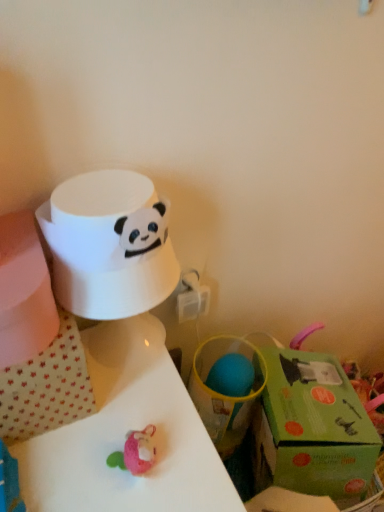
Question: In the image, is green cardboard gift box at lower right positioned in front of or behind white glossy table at center?

Choices:
 (A) front
 (B) behind

Answer: (B)

Question: Do you think green cardboard gift box at lower right is within white glossy table at center, or outside of it?

Choices:
 (A) outside
 (B) inside

Answer: (A)

Question: Based on their relative distances, which object is nearer to the white glossy table at center?

Choices:
 (A) white matte paper towel at upper left
 (B) green cardboard gift box at lower right

Answer: (A)

Question: Considering the real-world distances, which object is closest to the green cardboard gift box at lower right?

Choices:
 (A) white matte paper towel at upper left
 (B) white glossy table at center

Answer: (B)